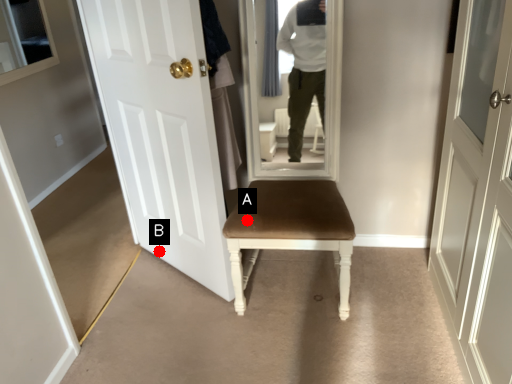
Question: Two points are circled on the image, labeled by A and B beside each circle. Which of the following is the closest to the observer?

Choices:
 (A) A is closer
 (B) B is closer

Answer: (A)